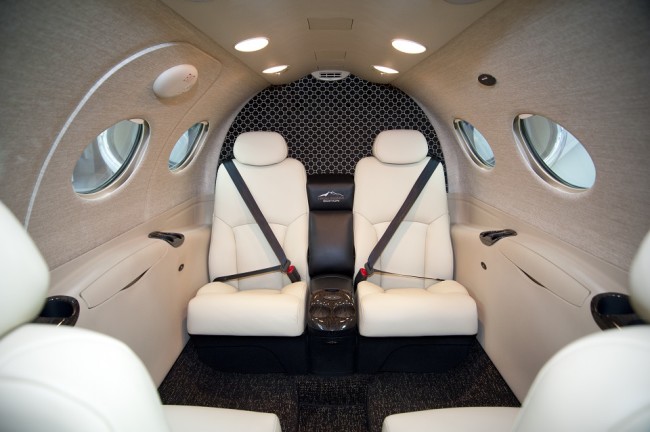
In order to click on glass in this screenshot , I will do `click(561, 151)`.